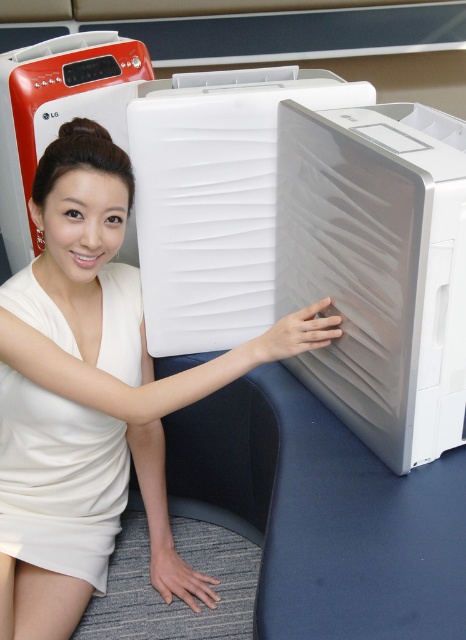
You are a photographer taking a portrait of the woman in the scene. You want to ensure that both the satin white cooler at center and the white satin dress at center are clearly visible in the photo. Which object should you focus on first to make sure it is in frame?

The satin white cooler at center is above the white satin dress at center, so you should focus on the white satin dress at center first to ensure it is in frame before adjusting the camera angle to include the cooler above it.

You are a photographer trying to capture the white satin dress at center and the satin white cooler at center in a photo. Which object will appear larger in the photo?

The satin white cooler at center will appear larger in the photo because it is closer to the viewer than the white satin dress at center.